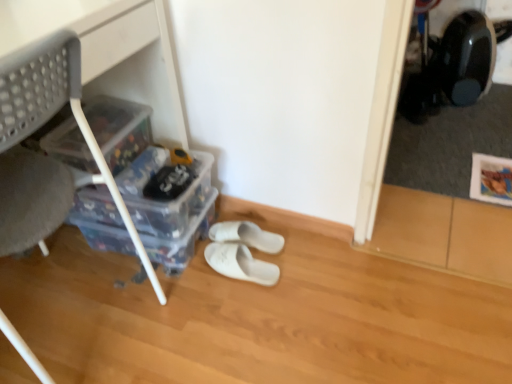
Question: Relative to white fabric slippers at center, which is the 1th footwear from back to front, is white plastic chair at left in front or behind?

Choices:
 (A) front
 (B) behind

Answer: (A)

Question: From their relative heights in the image, would you say white plastic chair at left is taller or shorter than white fabric slippers at center, which is the 1th footwear from back to front?

Choices:
 (A) tall
 (B) short

Answer: (A)

Question: Estimate the real-world distances between objects in this image. Which object is closer to the clear plastic storage box at left, arranged as the first storage box when viewed from the top?

Choices:
 (A) white fabric slippers at center, which is the 1th footwear from back to front
 (B) clear plastic storage box at lower left, acting as the 2th storage box starting from the top
 (C) white plastic chair at left
 (D) white fabric slippers at center, the first footwear from the front
 (E) transparent plastic storage box at lower left, the first storage box positioned from the bottom

Answer: (B)

Question: Which of these objects is positioned closest to the clear plastic storage box at lower left, acting as the 2th storage box starting from the top?

Choices:
 (A) transparent plastic storage box at lower left, the first storage box positioned from the bottom
 (B) white fabric slippers at center, the first footwear from the front
 (C) clear plastic storage box at left, arranged as the first storage box when viewed from the top
 (D) white plastic chair at left
 (E) white fabric slippers at center, which is counted as the second footwear, starting from the front

Answer: (A)